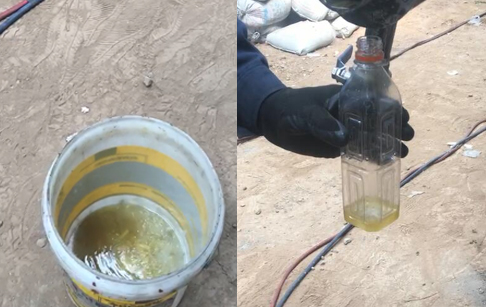
Locate an element on the screen. This screenshot has width=486, height=307. black cables is located at coordinates (306, 266), (11, 22).